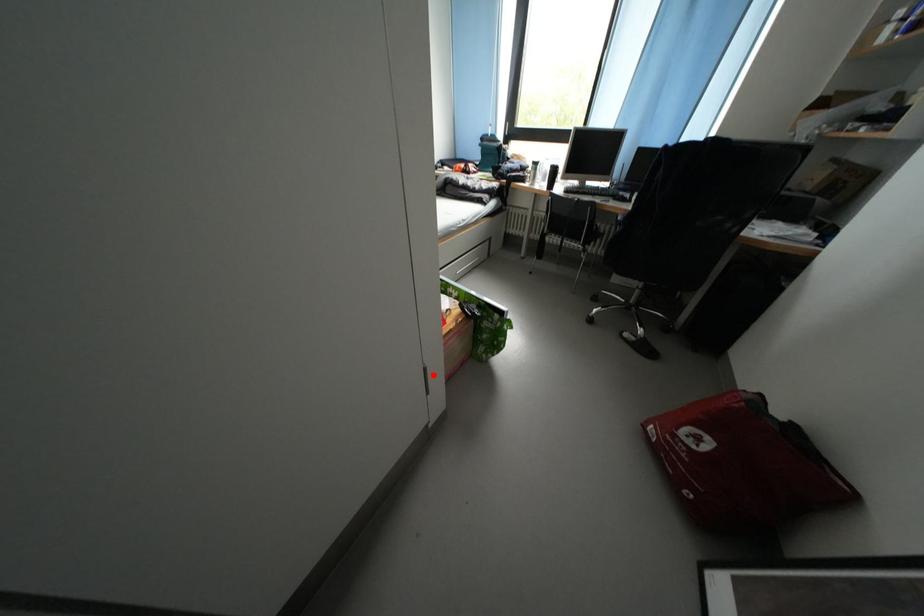
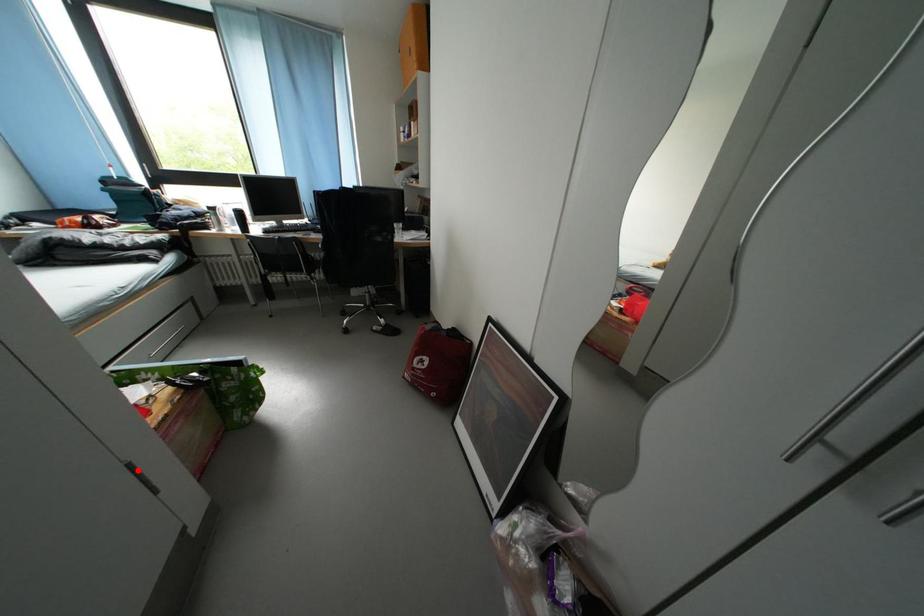
I am providing you with two images of the same scene from different viewpoints. A red point is marked on the first image and another point is marked on the second image. Do the highlighted points in image1 and image2 indicate the same real-world spot?

Yes